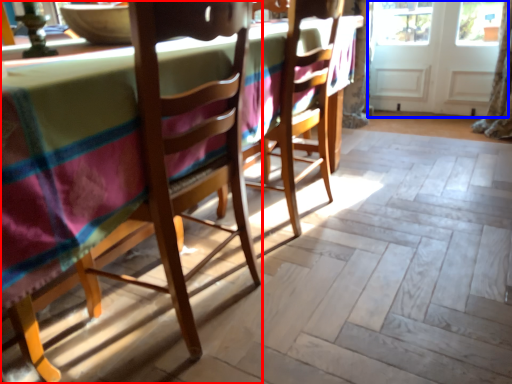
Question: Which object is further to the camera taking this photo, chair (highlighted by a red box) or screen door (highlighted by a blue box)?

Choices:
 (A) chair
 (B) screen door

Answer: (B)